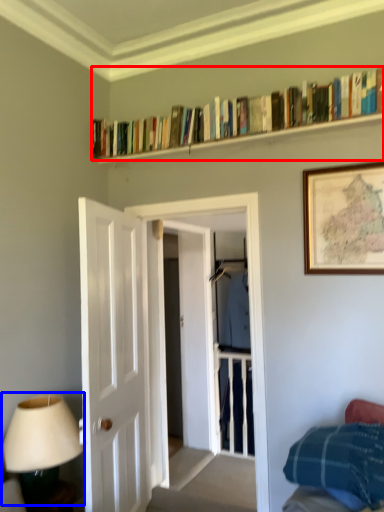
Question: Which object appears farthest to the camera in this image, book (highlighted by a red box) or table lamp (highlighted by a blue box)?

Choices:
 (A) book
 (B) table lamp

Answer: (A)